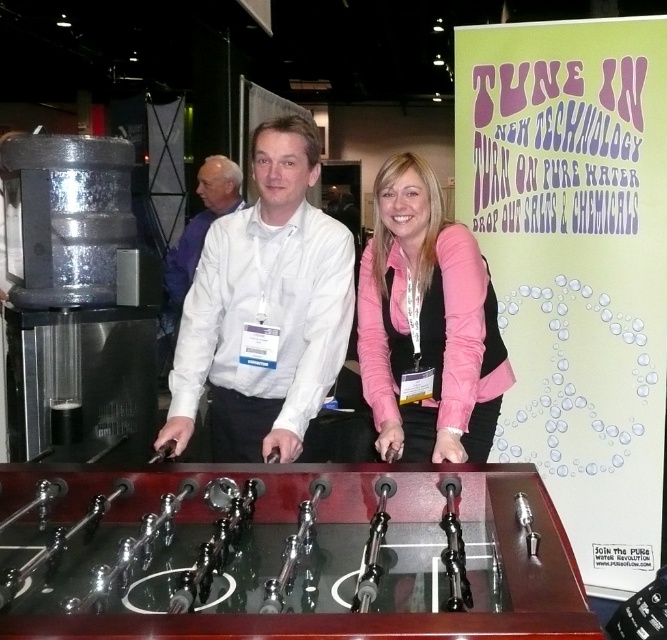
Describe the element at coordinates (428, 323) in the screenshot. I see `pink fabric shirt at center` at that location.

Between point (484, 406) and point (171, 310), which one is positioned in front?

Point (484, 406) is in front.

This screenshot has width=667, height=640. Find the location of `pink fabric shirt at center`. pink fabric shirt at center is located at coordinates (428, 323).

Who is more distant from viewer, (233, 580) or (257, 333)?

Point (257, 333)

Image resolution: width=667 pixels, height=640 pixels. What do you see at coordinates (283, 554) in the screenshot?
I see `shiny brown wooden foosball table at center` at bounding box center [283, 554].

The width and height of the screenshot is (667, 640). I want to click on shiny brown wooden foosball table at center, so click(283, 554).

Can you confirm if shiny brown wooden foosball table at center is smaller than white matte shirt at center?

Correct, shiny brown wooden foosball table at center occupies less space than white matte shirt at center.

Looking at this image, is shiny brown wooden foosball table at center thinner than white matte shirt at center?

In fact, shiny brown wooden foosball table at center might be wider than white matte shirt at center.

Between point (570, 636) and point (159, 342), which one is positioned behind?

The point (159, 342) is behind.

Identify the location of shiny brown wooden foosball table at center. The width and height of the screenshot is (667, 640). (283, 554).